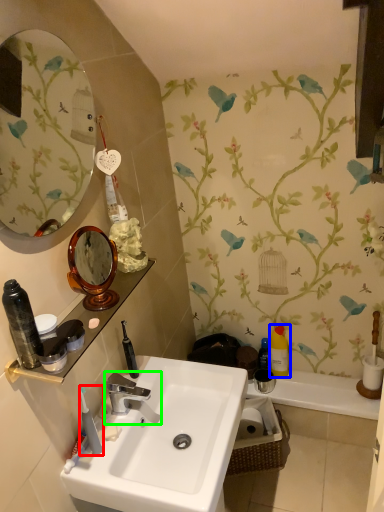
Question: Which object is positioned closest to toothbrush (highlighted by a red box)? Select from toiletry (highlighted by a blue box) and tap (highlighted by a green box).

Choices:
 (A) toiletry
 (B) tap

Answer: (B)